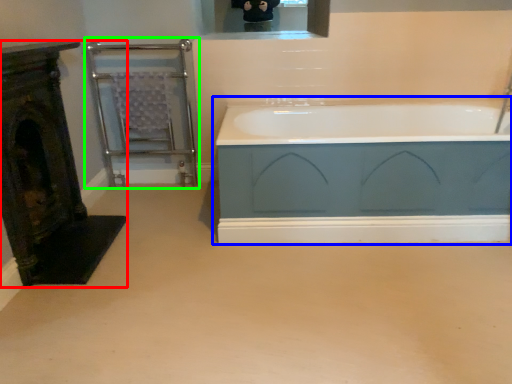
Question: Considering the real-world distances, which object is closest to fireplace (highlighted by a red box)? bathtub (highlighted by a blue box) or balustrade (highlighted by a green box).

Choices:
 (A) bathtub
 (B) balustrade

Answer: (B)